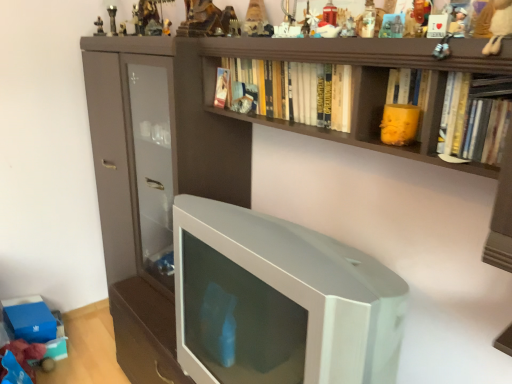
Question: Considering their positions, is matte paper book at upper center, the 3th book from the right, located in front of or behind hardcover book at upper right, positioned as the 3th book in back-to-front order?

Choices:
 (A) behind
 (B) front

Answer: (A)

Question: In the image, is matte paper book at upper center, which is counted as the 1th book, starting from the back, on the left side or the right side of hardcover book at upper right, positioned as the 3th book in back-to-front order?

Choices:
 (A) right
 (B) left

Answer: (B)

Question: Which object is positioned closest to the metallic chess piece at upper center, marked as the 1th toy in a left-to-right arrangement?

Choices:
 (A) yellow matte cup at upper center, which is the third toy from right to left
 (B) wooden heart at upper center, the 4th toy from the front
 (C) white matte plush toy at upper center, the 7th toy from the right
 (D) white glossy television at center
 (E) white plush toy at upper right, which is the 13th toy in back-to-front order

Answer: (C)

Question: Considering the real-world distances, which object is farthest from the matte paper book at upper center, which is counted as the 1th book, starting from the back?

Choices:
 (A) metallic chess piece at upper center, the first toy when ordered from back to front
 (B) white plush toy at upper right, which is the 13th toy in back-to-front order
 (C) metallic silver figurine at upper center, acting as the 8th toy starting from the back
 (D) translucent glass figurine at upper center, the 5th toy viewed from the front
 (E) metallic figurine at upper center, the second toy in the back-to-front sequence

Answer: (B)